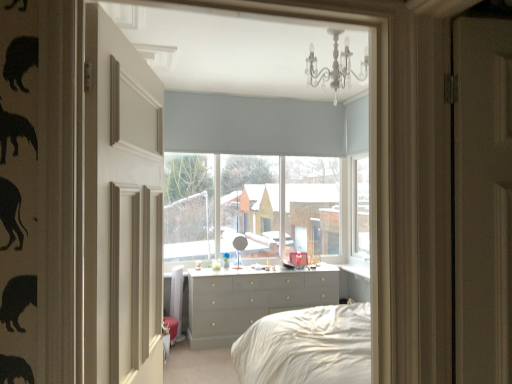
Question: In terms of size, does matte gray roller blind at center appear bigger or smaller than matte gray dresser at center?

Choices:
 (A) big
 (B) small

Answer: (A)

Question: Considering the positions of matte gray roller blind at center and matte gray dresser at center in the image, is matte gray roller blind at center taller or shorter than matte gray dresser at center?

Choices:
 (A) tall
 (B) short

Answer: (A)

Question: Which object is positioned closest to the matte white door at left?

Choices:
 (A) matte gray roller blind at center
 (B) white crystal chandelier at upper center
 (C) matte gray dresser at center
 (D) matte gray dresser at center
 (E) light grey fabric blind at upper center

Answer: (B)

Question: Which object is the closest to the matte gray dresser at center?

Choices:
 (A) light grey fabric blind at upper center
 (B) matte white door at left
 (C) white crystal chandelier at upper center
 (D) matte gray dresser at center
 (E) matte gray roller blind at center

Answer: (E)